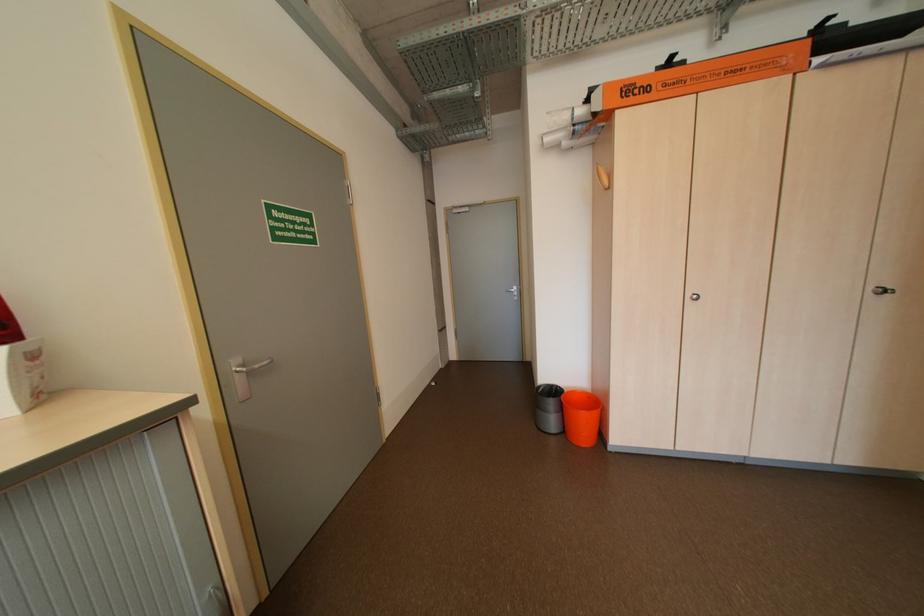
At what (x,y) coordinates should I click in order to perform the action: click on silver cabinet lock. Please return your answer as a coordinate pair (x, y). Looking at the image, I should click on (881, 291).